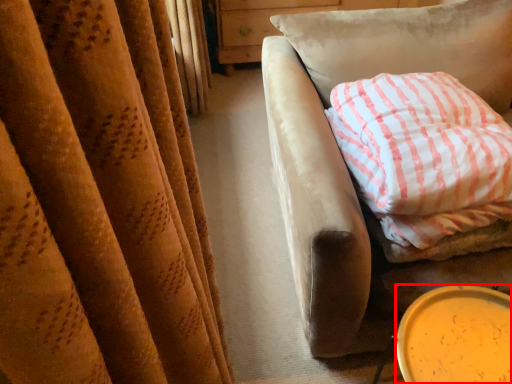
Question: From the image's perspective, where is beverage (annotated by the red box) located in relation to pillow in the image?

Choices:
 (A) above
 (B) below

Answer: (B)